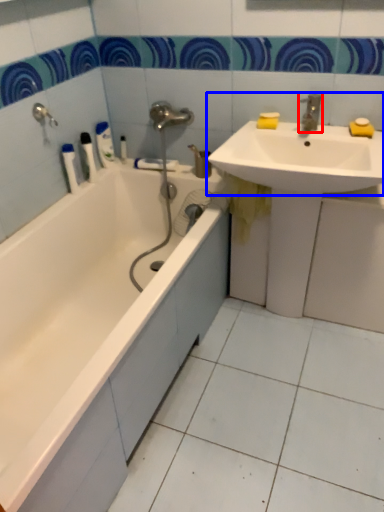
Question: Which object is further to the camera taking this photo, tap (highlighted by a red box) or sink (highlighted by a blue box)?

Choices:
 (A) tap
 (B) sink

Answer: (A)